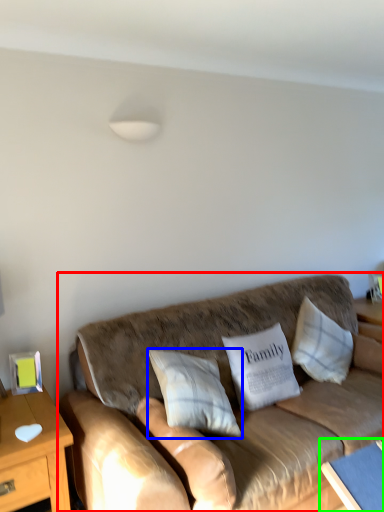
Question: Which object is positioned farthest from studio couch (highlighted by a red box)? Select from pillow (highlighted by a blue box) and table (highlighted by a green box).

Choices:
 (A) pillow
 (B) table

Answer: (B)